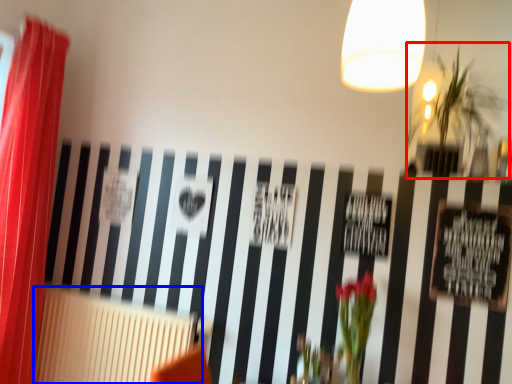
Question: Which point is further to the camera, plant (highlighted by a red box) or radiator (highlighted by a blue box)?

Choices:
 (A) plant
 (B) radiator

Answer: (B)